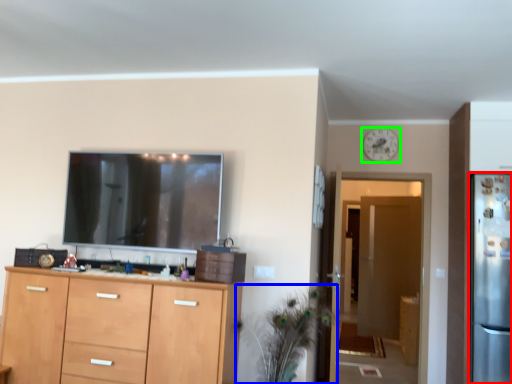
Question: Estimate the real-world distances between objects in this image. Which object is farther from refrigerator (highlighted by a red box), plant (highlighted by a blue box) or clock (highlighted by a green box)?

Choices:
 (A) plant
 (B) clock

Answer: (A)